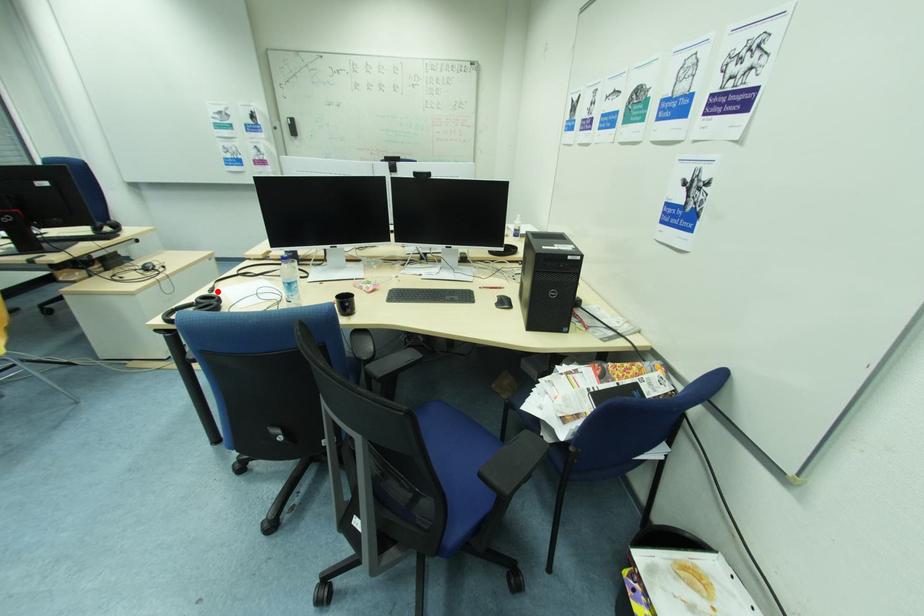
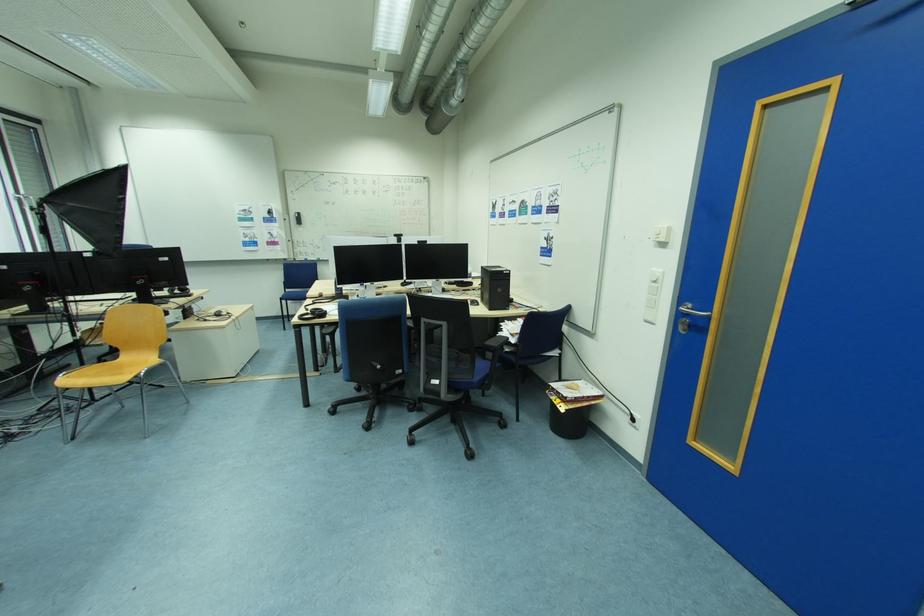
Locate, in the second image, the point that corresponds to the highlighted location in the first image.

(313, 310)